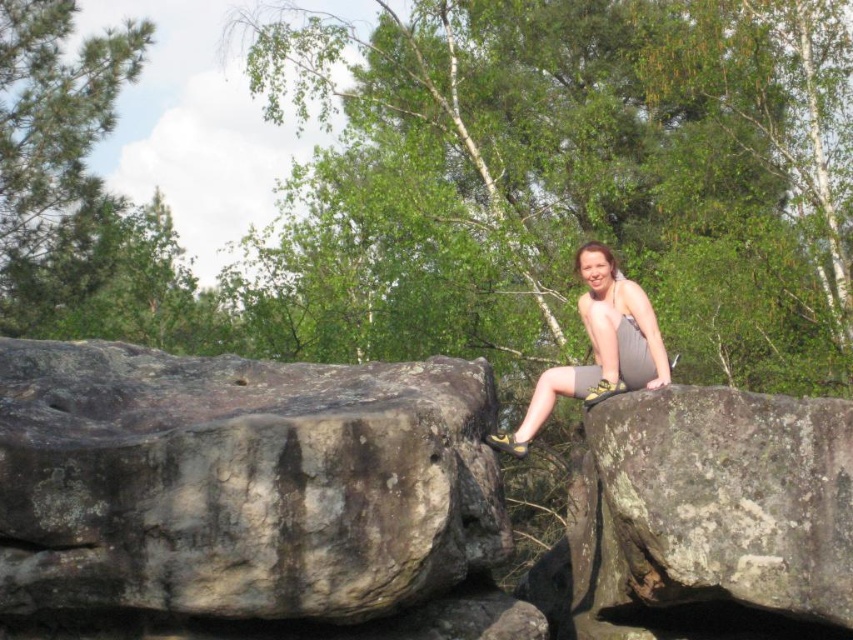
Is lichen-covered rock at center above gray fabric shorts at center?

Incorrect, lichen-covered rock at center is not positioned above gray fabric shorts at center.

Consider the image. Is lichen-covered rock at center shorter than gray fabric shorts at center?

In fact, lichen-covered rock at center may be taller than gray fabric shorts at center.

Is point (607, 556) positioned after point (514, 448)?

Yes.

Locate an element on the screen. lichen-covered rock at center is located at coordinates (712, 516).

Is gray rough rock at left closer to the viewer compared to lichen-covered rock at center?

Yes.

Between gray rough rock at left and lichen-covered rock at center, which one appears on the right side from the viewer's perspective?

Positioned to the right is lichen-covered rock at center.

Who is more distant from viewer, (84,468) or (643,595)?

Point (643,595)

Identify the location of gray rough rock at left. Image resolution: width=853 pixels, height=640 pixels. (241, 481).

Does point (177, 400) lie behind point (653, 337)?

No, (177, 400) is in front of (653, 337).

You are a GUI agent. You are given a task and a screenshot of the screen. Output one action in this format:
    pyautogui.click(x=<x>, y=<y>)
    Task: Click on the gray rough rock at left
    The height and width of the screenshot is (640, 853).
    Given the screenshot: What is the action you would take?
    pyautogui.click(x=241, y=481)